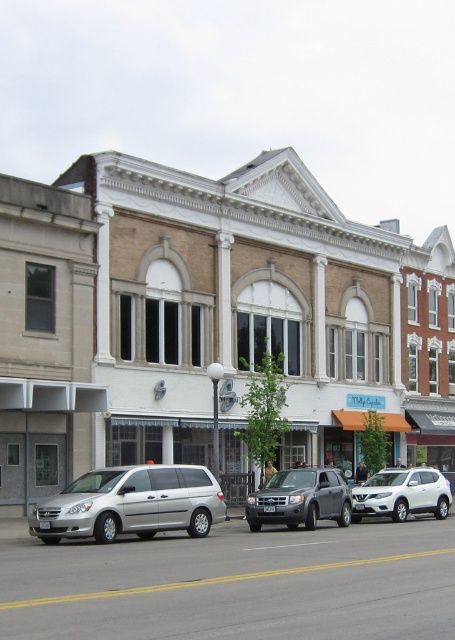
Question: Which object is positioned closest to the white matte suv at center?

Choices:
 (A) satin silver suv at center
 (B) silver metallic minivan at lower left

Answer: (A)

Question: Among these objects, which one is nearest to the camera?

Choices:
 (A) silver metallic minivan at lower left
 (B) silver metallic van at center

Answer: (A)

Question: Is silver metallic van at center below satin silver suv at center?

Choices:
 (A) yes
 (B) no

Answer: (B)

Question: Which point appears closest to the camera in this image?

Choices:
 (A) (75, 490)
 (B) (393, 504)

Answer: (A)

Question: Observing the image, what is the correct spatial positioning of silver metallic van at center in reference to satin silver suv at center?

Choices:
 (A) below
 (B) above

Answer: (B)

Question: Does silver metallic van at center have a greater width compared to satin silver suv at center?

Choices:
 (A) no
 (B) yes

Answer: (B)